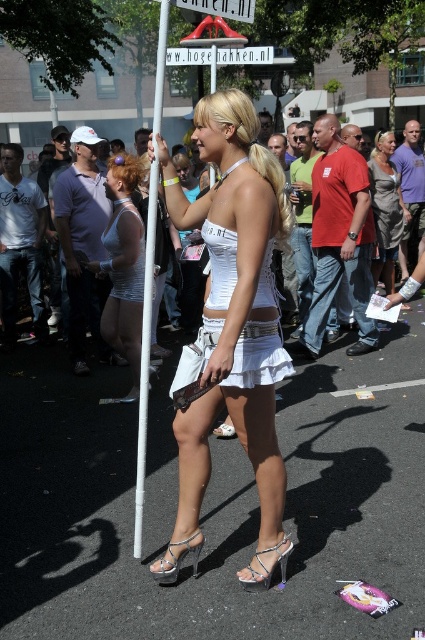
Question: Does white matte dress at left have a greater width compared to silver metallic high-heeled sandal at lower center?

Choices:
 (A) yes
 (B) no

Answer: (A)

Question: Which point is farther from the camera taking this photo?

Choices:
 (A) [x=163, y=564]
 (B) [x=399, y=216]
 (C) [x=107, y=257]
 (D) [x=130, y=236]

Answer: (B)

Question: Does matte silver pole at center have a greater width compared to silky gray dress at center?

Choices:
 (A) no
 (B) yes

Answer: (A)

Question: Which point is farther to the camera?

Choices:
 (A) (155, 573)
 (B) (119, 204)
 (C) (380, 196)

Answer: (C)

Question: Observing the image, what is the correct spatial positioning of silky gray dress at center in reference to clear crystal sandal at lower center?

Choices:
 (A) above
 (B) below

Answer: (A)

Question: Estimate the real-world distances between objects in this image. Which object is closer to the white matte dress at left?

Choices:
 (A) matte silver pole at center
 (B) white satin dress at center
 (C) silky gray dress at center

Answer: (A)